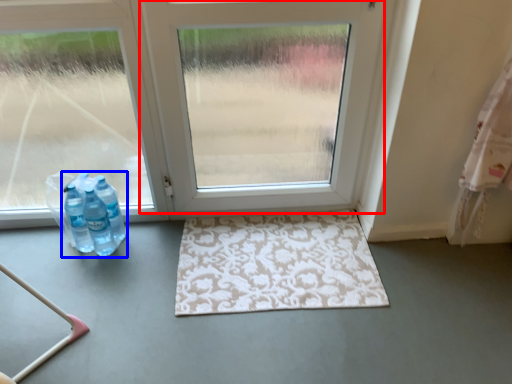
Question: Among these objects, which one is farthest to the camera, door (highlighted by a red box) or bottle (highlighted by a blue box)?

Choices:
 (A) door
 (B) bottle

Answer: (B)